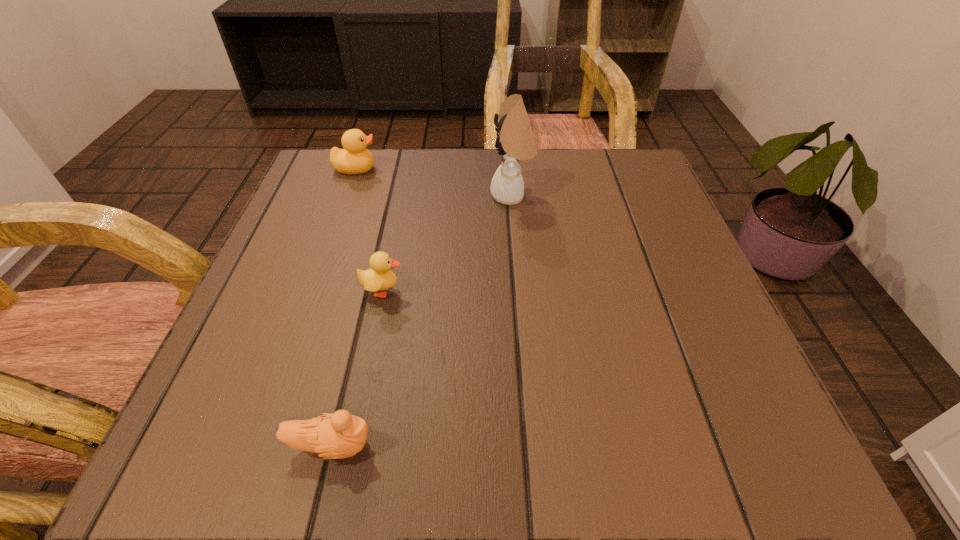
You are a GUI agent. You are given a task and a screenshot of the screen. Output one action in this format:
    pyautogui.click(x=<x>, y=<y>)
    Task: Click on the tallest object
    This screenshot has height=540, width=960.
    Given the screenshot: What is the action you would take?
    pyautogui.click(x=515, y=141)

The height and width of the screenshot is (540, 960). I want to click on the rightmost object, so click(515, 141).

Where is `the farthest duckling`? The image size is (960, 540). the farthest duckling is located at coordinates (354, 159).

Locate an element on the screen. the second farthest duckling is located at coordinates (378, 278).

Find the location of a particular element. The width and height of the screenshot is (960, 540). the nearest object is located at coordinates (340, 435).

The image size is (960, 540). What are the coordinates of `vacant area situated at the front face of the doll` in the screenshot? It's located at (372, 195).

The height and width of the screenshot is (540, 960). Find the location of `free region located at the front face of the doll`. free region located at the front face of the doll is located at coordinates pyautogui.click(x=349, y=195).

Locate an element on the screen. vacant area located 0.160m at the front face of the doll is located at coordinates (415, 195).

Find the location of a particular element. The image size is (960, 540). vacant position located on the face of the farthest duckling is located at coordinates (500, 168).

Identify the location of free space located 0.340m on the front-facing side of the second farthest duckling. (605, 291).